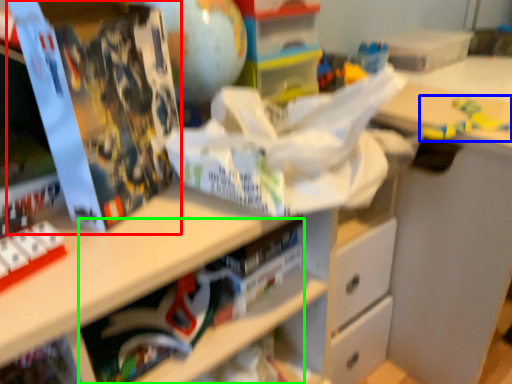
Question: Which is farther away from paperback book (highlighted by a red box)? toy (highlighted by a blue box) or book (highlighted by a green box)?

Choices:
 (A) toy
 (B) book

Answer: (A)